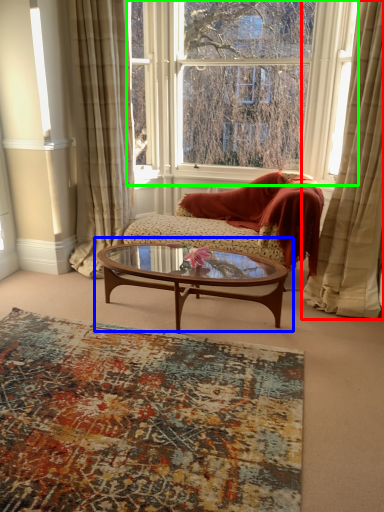
Question: Based on their relative distances, which object is farther from curtain (highlighted by a red box)? Choose from coffee table (highlighted by a blue box) and window (highlighted by a green box).

Choices:
 (A) coffee table
 (B) window

Answer: (B)